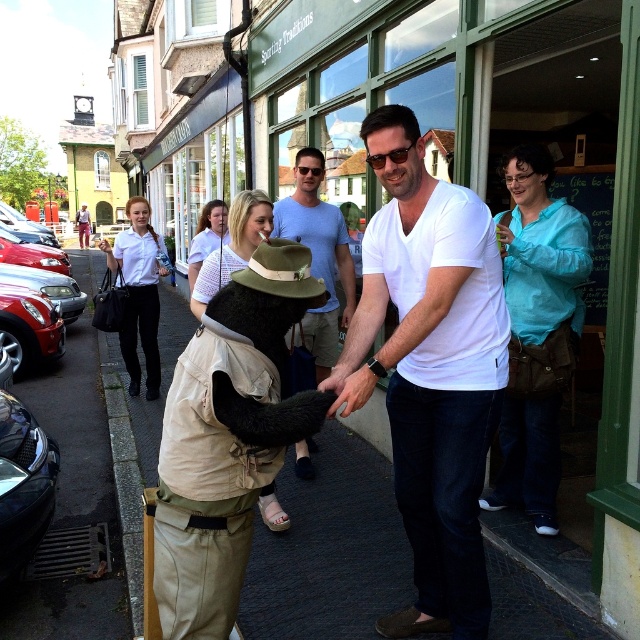
You are standing in the center of the street looking towards the clock tower. There is a point marked at coordinates (429, 369). What object is located at that point?

The point at coordinates (429, 369) indicates the white cotton shirt at center.